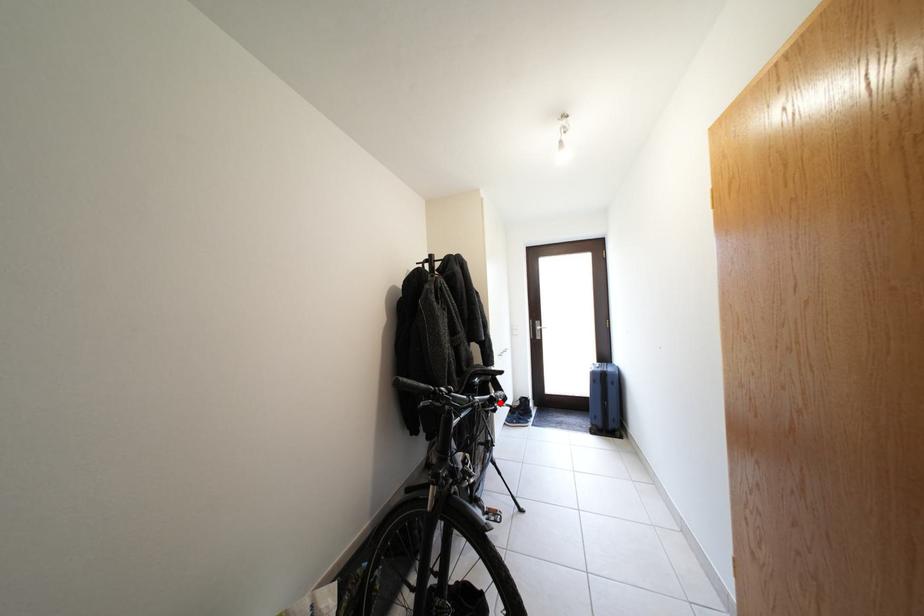
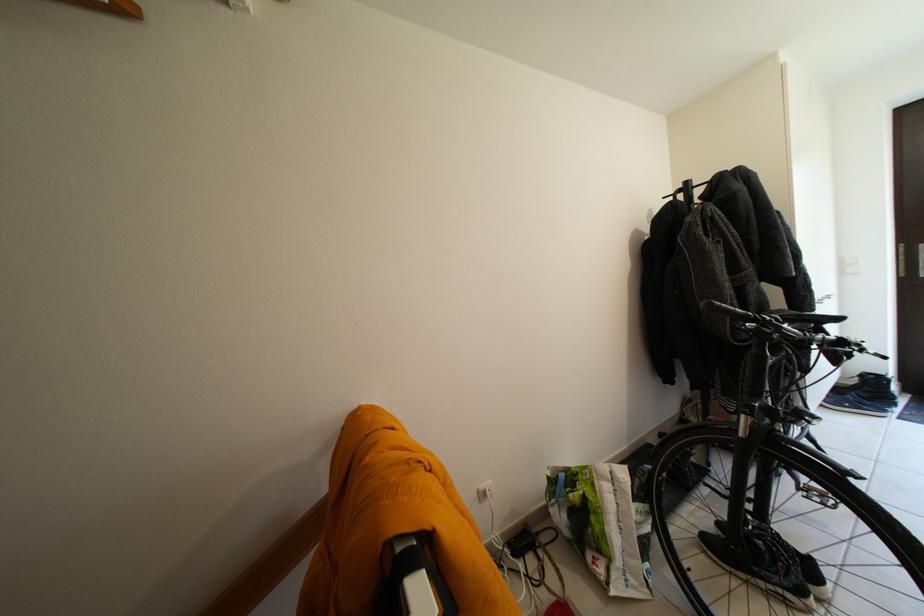
Question: I am providing you with two images of the same scene from different viewpoints. Given a red point in image1, look at the same physical point in image2. Is it:

Choices:
 (A) Closer to the viewpoint
 (B) Farther from the viewpoint

Answer: (A)